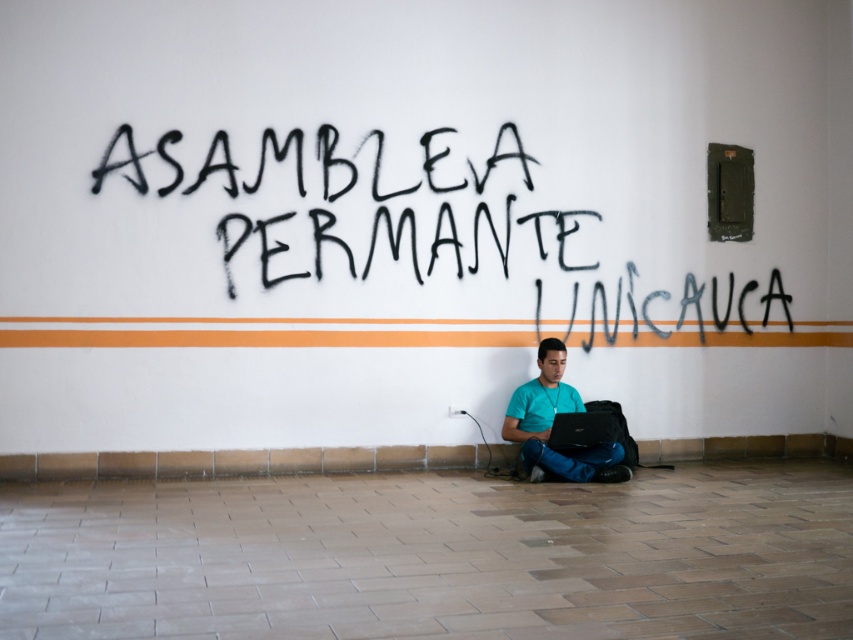
Consider the image. You are a security guard in the building and need to check the electrical panel on the wall. You are currently standing at the black matte laptop at lower center. Which direction should you move to reach the electrical panel, considering the black spray paint graffiti at upper center is to its right?

The black spray paint graffiti at upper center is to the right of the black matte laptop at lower center. Since the electrical panel is to the right of the graffiti, you should move to the right from the black matte laptop at lower center to reach the electrical panel.

Consider the image. You are a photographer trying to capture a closeup of the black matte laptop at lower center without including the teal matte shirt at lower center in the frame. Given their positions, is this possible?

The teal matte shirt at lower center might be wider than black matte laptop at lower center, so there is a possibility that the shirt could block the view of the laptop depending on their exact placement. To ensure the laptop is fully visible without the shirt, you may need to adjust your angle or position to frame around the shirt.

You are standing in the building and see two points marked on the wall. The first point is at coordinates point (605, 442) and the second is at point (550, 445). Which point is closer to you?

Point (605, 442) is closer to the camera than point (550, 445), so the first point is closer to you.